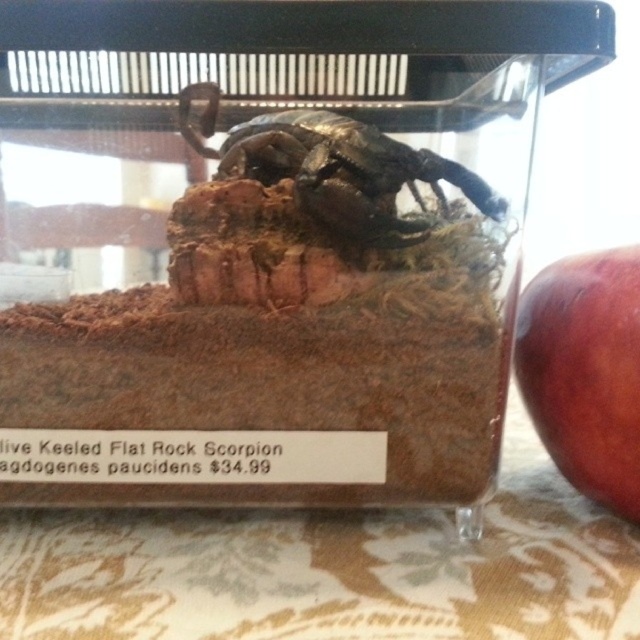
Is red matte apple at right shorter than metallic scorpion at center?

Incorrect, red matte apple at right's height does not fall short of metallic scorpion at center's.

Which is above, red matte apple at right or metallic scorpion at center?

metallic scorpion at center

Does point (605, 282) lie behind point (292, 179)?

No, (605, 282) is closer to viewer.

The height and width of the screenshot is (640, 640). I want to click on red matte apple at right, so click(x=586, y=371).